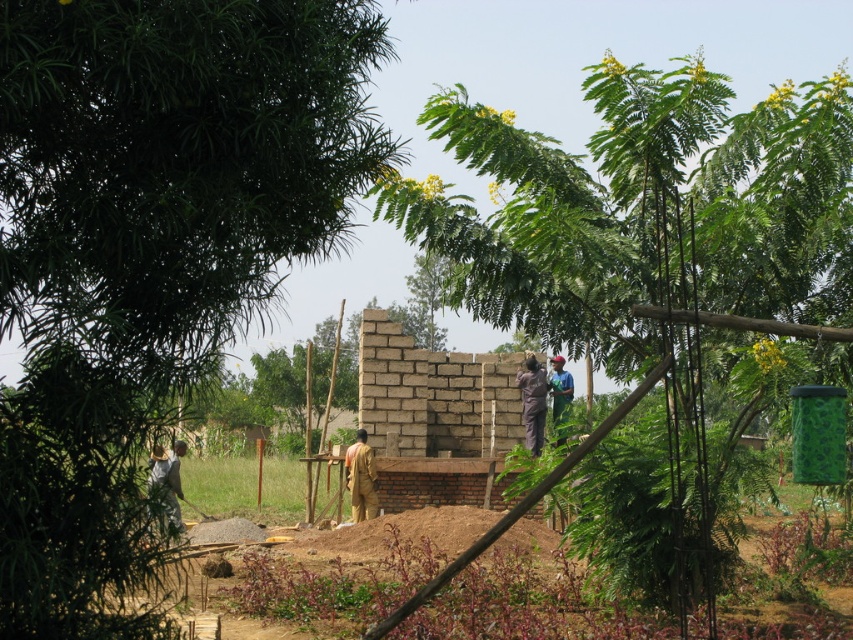
From the picture: You are a construction supervisor checking the safety of workers in the rural construction site. You notice two workers, one wearing a light brown fabric shirt at lower left and another in a dark blue shirt at center. Which worker is positioned closer to the entrance of the construction site?

The light brown fabric shirt at lower left is closer to the viewer than the dark blue shirt at center, so the worker in the light brown fabric shirt at lower left is closer to the entrance of the construction site.

You are standing at the center of the construction site and need to locate the light brown fabric shirt at lower left. According to the coordinates provided, in which direction should you look to find it?

The light brown fabric shirt at lower left is located at point 0.752 on the x axis and 0.198 on the y axis. Since the coordinates are based on a grid where 0 is the bottom left corner and 1 is the top right corner, the shirt is positioned towards the lower left area of the image. Therefore, you should look towards the lower left direction from the center to find it.